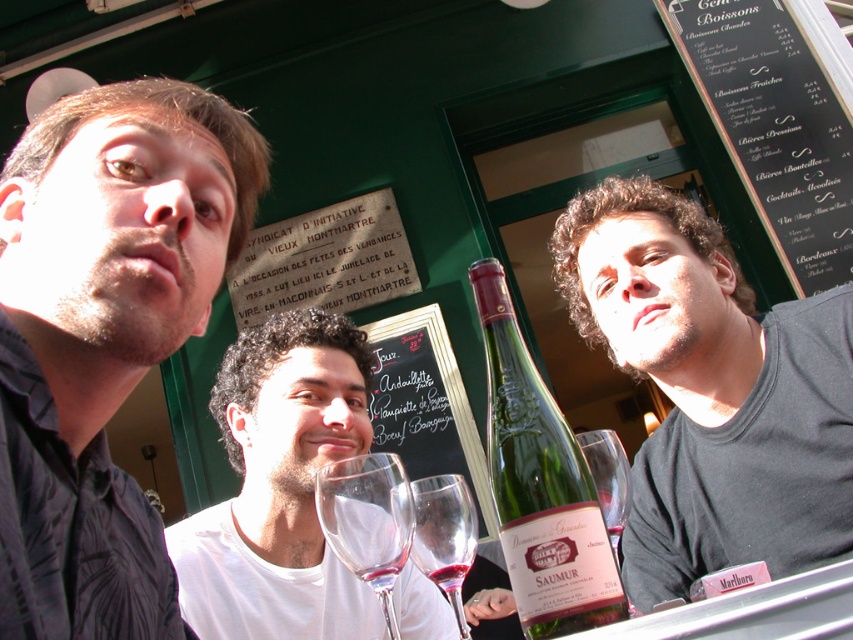
Question: Does white matte wine glass at center appear under transparent glass wine glass at center?

Choices:
 (A) yes
 (B) no

Answer: (A)

Question: Does transparent glass at center lie in front of clear glass wine glass at center?

Choices:
 (A) yes
 (B) no

Answer: (B)

Question: Which object is closer to the camera taking this photo?

Choices:
 (A) black matte shirt at right
 (B) green glass bottle at center
 (C) black chalkboard menu at upper right

Answer: (B)

Question: Considering the relative positions of black matte shirt at right and black chalkboard at center in the image provided, where is black matte shirt at right located with respect to black chalkboard at center?

Choices:
 (A) left
 (B) right

Answer: (B)

Question: Among these points, which one is farthest from the camera?

Choices:
 (A) pyautogui.click(x=795, y=499)
 (B) pyautogui.click(x=616, y=541)

Answer: (A)

Question: Which object is positioned closest to the dark gray shirt at left?

Choices:
 (A) transparent glass wine glass at center
 (B) black chalkboard at center

Answer: (A)